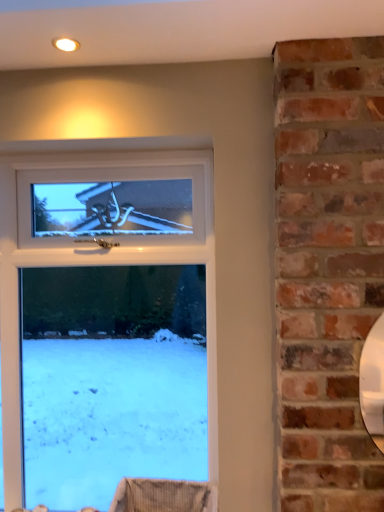
Image resolution: width=384 pixels, height=512 pixels. I want to click on cardboard box at lower center, so [164, 496].

The width and height of the screenshot is (384, 512). Describe the element at coordinates (164, 496) in the screenshot. I see `cardboard box at lower center` at that location.

Measure the distance between cardboard box at lower center and camera.

They are 4.59 feet apart.

Where is `cardboard box at lower center`? Image resolution: width=384 pixels, height=512 pixels. cardboard box at lower center is located at coordinates (164, 496).